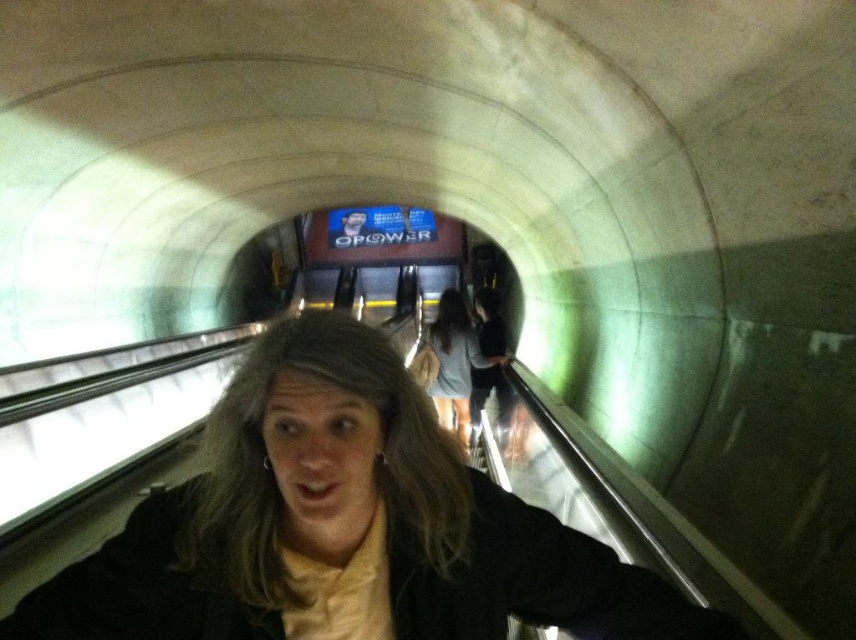
You are a designer creating a layout for a subway advertisement. You need to ensure that the advertisement can accommodate both the matte black jacket at center and the light gray fabric skirt at center without overlapping. Which object should you prioritize placing first to account for its larger size?

The matte black jacket at center should be prioritized since it is wider than the light gray fabric skirt at center, ensuring there is enough space for both in the advertisement layout.

You are standing on the escalator in the subway station and notice two items at the center of your view. The matte black jacket at center and the light gray fabric skirt at center. Which one appears taller in the scene?

The light gray fabric skirt at center appears taller than the matte black jacket at center because the matte black jacket at center is not as tall as the light gray fabric skirt at center.

You are standing on the escalator and want to hand a 12 inch long item to the person wearing the matte black jacket at center. Can you reach them without moving from your current position?

The matte black jacket at center is 31.36 inches away from the camera, so yes, you can reach them with a 12 inch long item since the distance is greater than the item length.